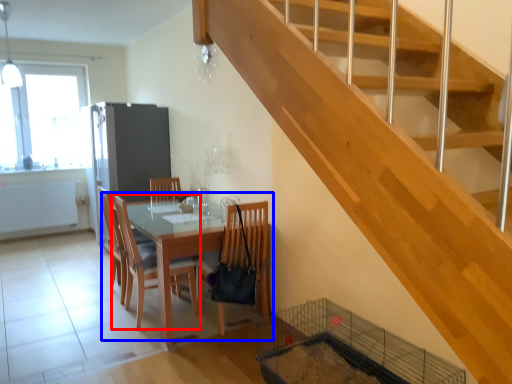
Question: Which of the following is the farthest to the observer, chair (highlighted by a red box) or kitchen & dining room table (highlighted by a blue box)?

Choices:
 (A) chair
 (B) kitchen & dining room table

Answer: (A)